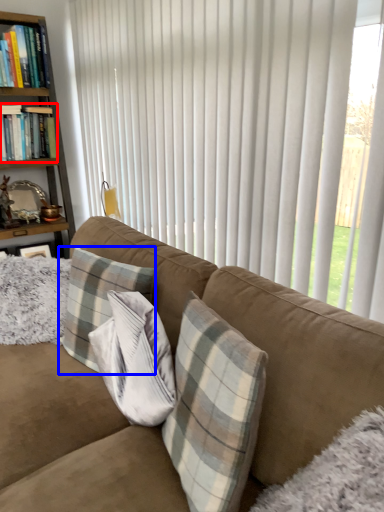
Question: Which of the following is the closest to the observer, book (highlighted by a red box) or pillow (highlighted by a blue box)?

Choices:
 (A) book
 (B) pillow

Answer: (B)